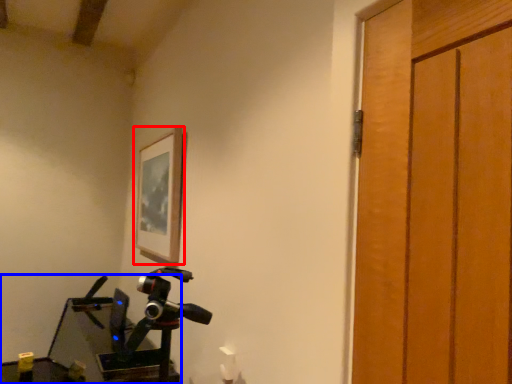
Question: Which object is further to the camera taking this photo, picture frame (highlighted by a red box) or workbench (highlighted by a blue box)?

Choices:
 (A) picture frame
 (B) workbench

Answer: (A)